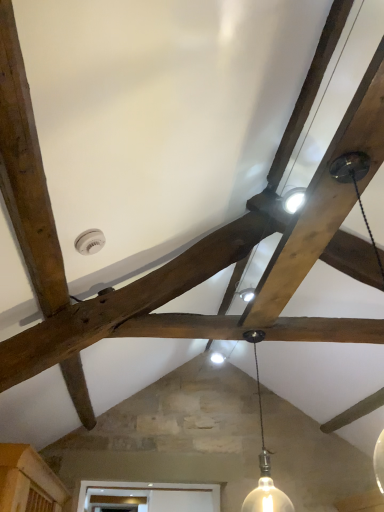
Where is `matte white bulb at center`? This screenshot has width=384, height=512. matte white bulb at center is located at coordinates tap(264, 460).

This screenshot has height=512, width=384. Describe the element at coordinates (264, 460) in the screenshot. I see `matte white bulb at center` at that location.

Where is `matte white bulb at center`? This screenshot has width=384, height=512. matte white bulb at center is located at coordinates (264, 460).